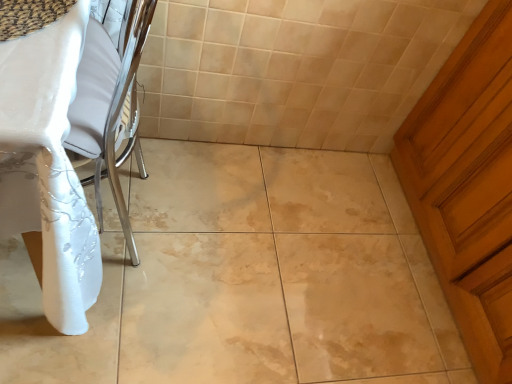
Question: From a real-world perspective, is wooden door at right physically located above or below white glossy table at left?

Choices:
 (A) below
 (B) above

Answer: (A)

Question: In the image, is wooden door at right positioned in front of or behind white glossy table at left?

Choices:
 (A) front
 (B) behind

Answer: (B)

Question: Is wooden door at right wider or thinner than white glossy table at left?

Choices:
 (A) thin
 (B) wide

Answer: (A)

Question: Is point (90, 248) closer or farther from the camera than point (462, 231)?

Choices:
 (A) closer
 (B) farther

Answer: (A)

Question: Considering their positions, is white glossy table at left located in front of or behind wooden door at right?

Choices:
 (A) front
 (B) behind

Answer: (A)

Question: In terms of width, does white glossy table at left look wider or thinner when compared to wooden door at right?

Choices:
 (A) thin
 (B) wide

Answer: (B)

Question: Considering the positions of white glossy table at left and wooden door at right in the image, is white glossy table at left taller or shorter than wooden door at right?

Choices:
 (A) short
 (B) tall

Answer: (B)